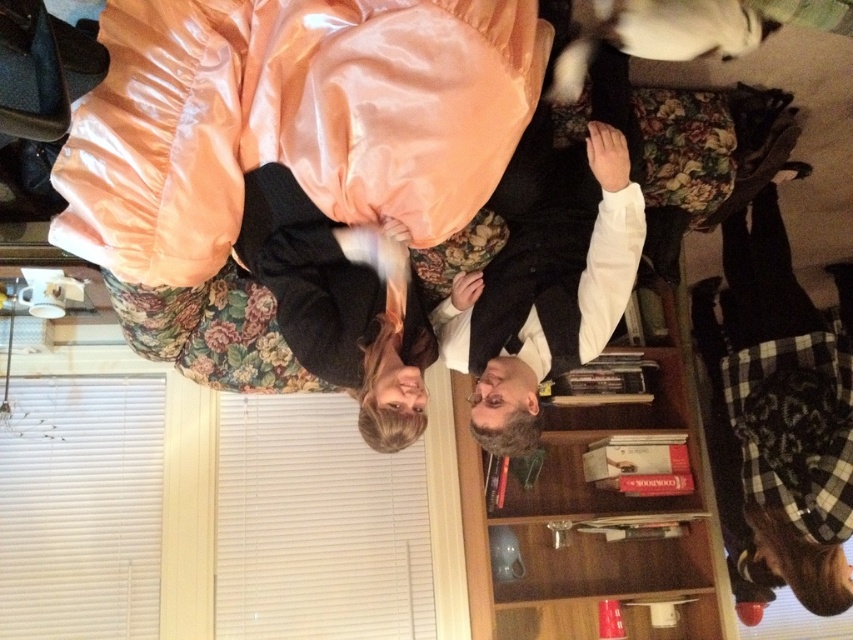
Measure the distance between silky peach sleeping bag at upper left and camera.

silky peach sleeping bag at upper left is 1.37 meters from camera.

Is point (436, 99) farther from viewer compared to point (663, 310)?

No, it is in front of (663, 310).

At what (x,y) coordinates should I click in order to perform the action: click on silky peach sleeping bag at upper left. Please return your answer as a coordinate pair (x, y). This screenshot has width=853, height=640. Looking at the image, I should click on (289, 120).